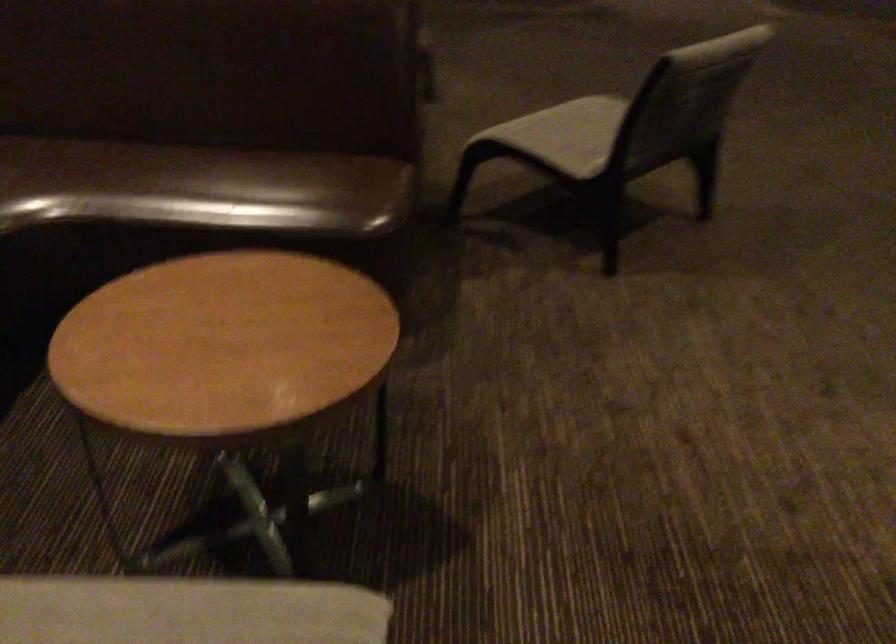
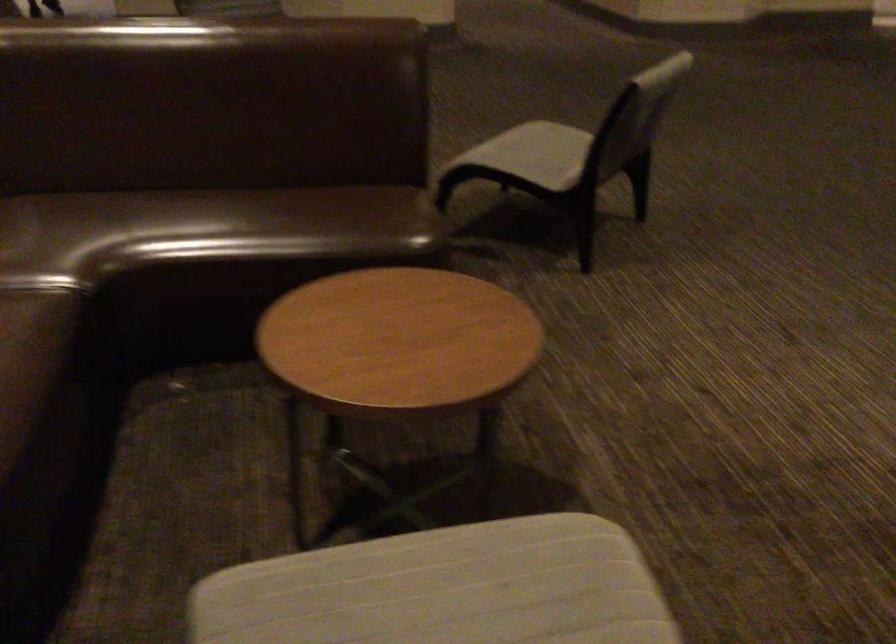
Locate, in the second image, the point that corresponds to [573,133] in the first image.

(533, 154)